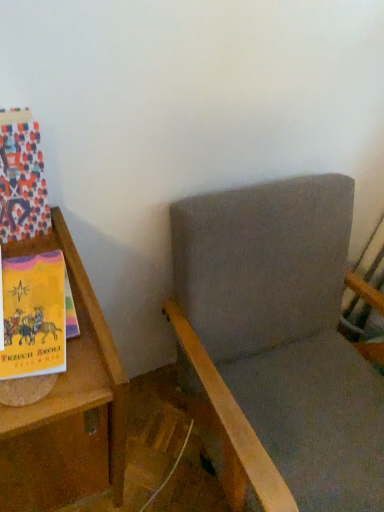
This screenshot has width=384, height=512. In order to click on wooden bookshelf at left in this screenshot , I will do `click(68, 408)`.

What do you see at coordinates (22, 178) in the screenshot?
I see `multicolored paper at left` at bounding box center [22, 178].

Where is `wooden bookshelf at left`? The height and width of the screenshot is (512, 384). wooden bookshelf at left is located at coordinates point(68,408).

Is wooden bookshelf at left to the right of gray fabric rocking chair at center from the viewer's perspective?

No, wooden bookshelf at left is not to the right of gray fabric rocking chair at center.

From a real-world perspective, between wooden bookshelf at left and gray fabric rocking chair at center, who is vertically lower?

In real-world perspective, wooden bookshelf at left is lower.

Which is farther from the camera, [74,258] or [301,430]?

The point [301,430] is more distant.

Which object is wider, wooden bookshelf at left or gray fabric rocking chair at center?

With larger width is gray fabric rocking chair at center.

In the scene shown: Is multicolored paper at left touching wooden bookshelf at left?

No, multicolored paper at left is not with wooden bookshelf at left.

Between multicolored paper at left and wooden bookshelf at left, which one appears on the left side from the viewer's perspective?

multicolored paper at left.

Could you tell me if multicolored paper at left is facing wooden bookshelf at left?

No, multicolored paper at left is not oriented towards wooden bookshelf at left.

Is gray fabric rocking chair at center closer to camera compared to multicolored paper at left?

Yes.

Could you tell me if gray fabric rocking chair at center is facing multicolored paper at left?

No, gray fabric rocking chair at center is not aimed at multicolored paper at left.

Between gray fabric rocking chair at center and multicolored paper at left, which one has larger width?

gray fabric rocking chair at center.

How different are the orientations of multicolored paper at left and gray fabric rocking chair at center in degrees?

They differ by 0.422 degrees in their facing directions.

Is multicolored paper at left oriented towards gray fabric rocking chair at center?

No.

From a real-world perspective, is multicolored paper at left on top of gray fabric rocking chair at center?

Correct, in the physical world, multicolored paper at left is higher than gray fabric rocking chair at center.

Is multicolored paper at left further to the viewer compared to gray fabric rocking chair at center?

Yes, multicolored paper at left is further from the viewer.

Can you tell me how much gray fabric rocking chair at center and wooden bookshelf at left differ in facing direction?

They differ by 4.03e-05 degrees in their facing directions.

Can you confirm if gray fabric rocking chair at center is shorter than wooden bookshelf at left?

In fact, gray fabric rocking chair at center may be taller than wooden bookshelf at left.

Considering the positions of points (238, 341) and (82, 468), is point (238, 341) closer to camera compared to point (82, 468)?

No, (238, 341) is behind (82, 468).

Is gray fabric rocking chair at center wider than wooden bookshelf at left?

Yes.

Does wooden bookshelf at left contain multicolored paper at left?

A: Definitely not — multicolored paper at left is not inside wooden bookshelf at left.

From the image's perspective, is wooden bookshelf at left above or below multicolored paper at left?

Based on their image positions, wooden bookshelf at left is located beneath multicolored paper at left.

Is wooden bookshelf at left closer to the viewer compared to multicolored paper at left?

Yes, it is in front of multicolored paper at left.

Does wooden bookshelf at left have a lesser height compared to multicolored paper at left?

No.

The height and width of the screenshot is (512, 384). Find the location of `rocking chair that is on the right side of wooden bookshelf at left`. rocking chair that is on the right side of wooden bookshelf at left is located at coordinates (278, 343).

There is a wooden bookshelf at left. Identify the location of paperback book above it (from a real-world perspective). The height and width of the screenshot is (512, 384). pyautogui.click(x=22, y=178).

Based on the photo, looking at the image, which one is located further to gray fabric rocking chair at center, multicolored paper at left or wooden bookshelf at left?

Among the two, multicolored paper at left is located further to gray fabric rocking chair at center.

Looking at the image, which one is located further to wooden bookshelf at left, multicolored paper at left or gray fabric rocking chair at center?

Based on the image, gray fabric rocking chair at center appears to be further to wooden bookshelf at left.

Based on their spatial positions, is gray fabric rocking chair at center or wooden bookshelf at left closer to multicolored paper at left?

wooden bookshelf at left is positioned closer to the anchor multicolored paper at left.

From the image, which object appears to be farther from wooden bookshelf at left, gray fabric rocking chair at center or multicolored paper at left?

gray fabric rocking chair at center lies further to wooden bookshelf at left than the other object.

Which object lies further to the anchor point multicolored paper at left, wooden bookshelf at left or gray fabric rocking chair at center?

Based on the image, gray fabric rocking chair at center appears to be further to multicolored paper at left.

Based on their spatial positions, is wooden bookshelf at left or multicolored paper at left closer to gray fabric rocking chair at center?

Based on the image, wooden bookshelf at left appears to be nearer to gray fabric rocking chair at center.

Locate an element on the screen. furniture between multicolored paper at left and gray fabric rocking chair at center from left to right is located at coordinates (68, 408).